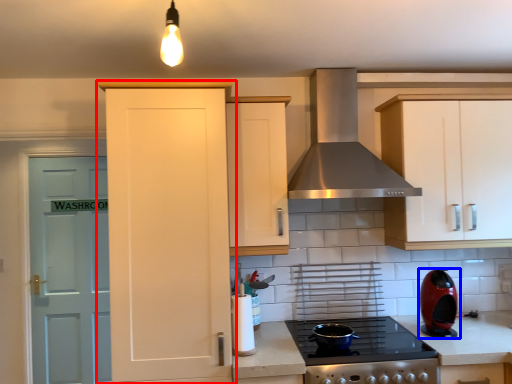
Question: Among these objects, which one is farthest to the camera, cabinetry (highlighted by a red box) or kitchen appliance (highlighted by a blue box)?

Choices:
 (A) cabinetry
 (B) kitchen appliance

Answer: (B)